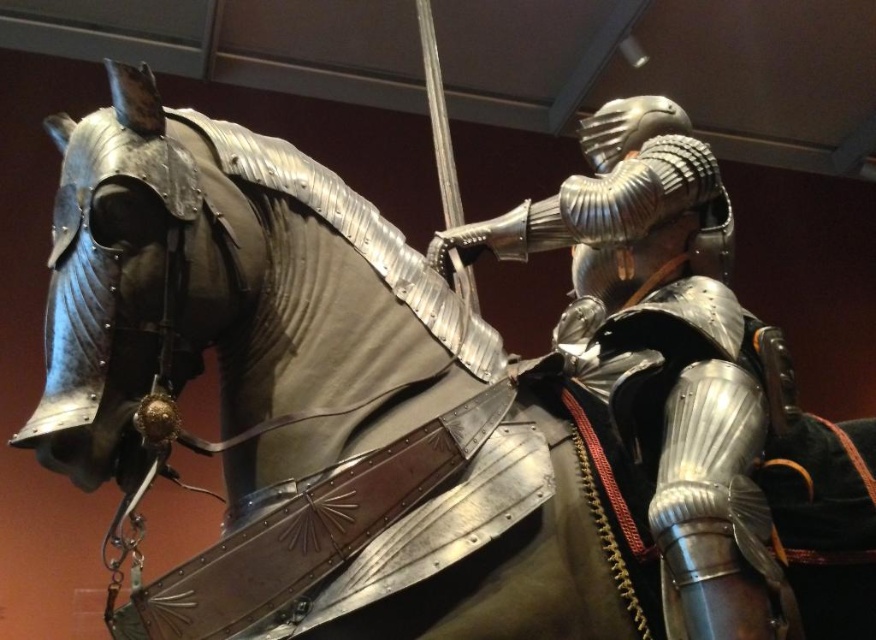
Question: Does shiny silver armor at center appear on the left side of metallic/textured helmet at upper center?

Choices:
 (A) no
 (B) yes

Answer: (B)

Question: Which object is closer to the camera taking this photo?

Choices:
 (A) metallic/textured helmet at upper center
 (B) shiny silver armor at center

Answer: (B)

Question: Is shiny silver armor at center above metallic/textured helmet at upper center?

Choices:
 (A) yes
 (B) no

Answer: (B)

Question: Which of the following is the farthest from the observer?

Choices:
 (A) (623, 243)
 (B) (675, 116)

Answer: (B)

Question: Does shiny silver armor at center have a lesser width compared to metallic/textured helmet at upper center?

Choices:
 (A) no
 (B) yes

Answer: (A)